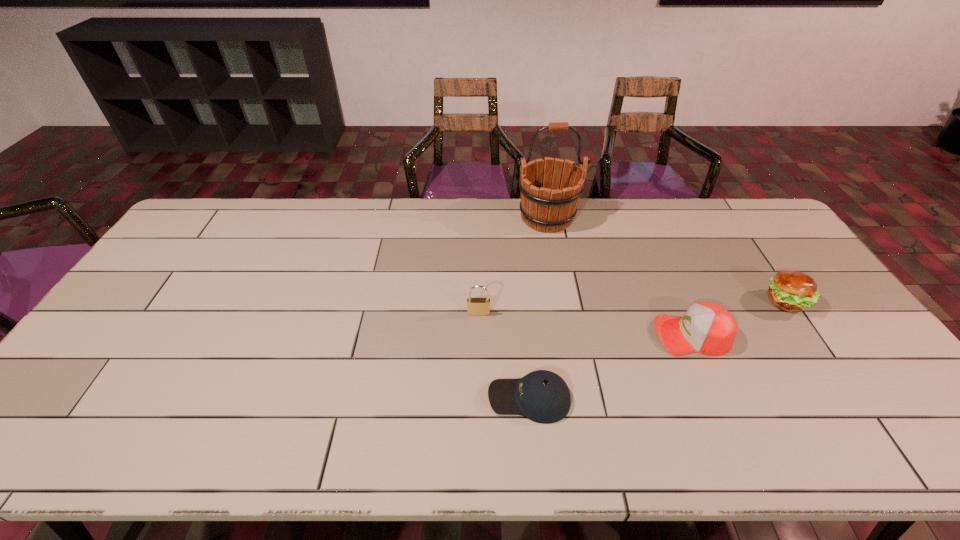
The image size is (960, 540). What are the coordinates of `free space between the right baseball cap and the padlock` in the screenshot? It's located at (586, 324).

Find the location of a particular element. The height and width of the screenshot is (540, 960). vacant area between the left baseball cap and the padlock is located at coordinates (504, 356).

Locate an element on the screen. Image resolution: width=960 pixels, height=540 pixels. empty space that is in between the padlock and the wine bucket is located at coordinates click(x=513, y=265).

Find the location of a particular element. This screenshot has height=540, width=960. empty space between the wine bucket and the shortest object is located at coordinates (538, 308).

Where is `free space between the taller baseball cap and the hamburger`? free space between the taller baseball cap and the hamburger is located at coordinates (739, 318).

I want to click on free space between the tallest object and the padlock, so click(513, 265).

Image resolution: width=960 pixels, height=540 pixels. Identify the location of blank region between the padlock and the tallest object. (513, 265).

Point out which object is positioned as the third nearest to the taller baseball cap. Please provide its 2D coordinates. Your answer should be formatted as a tuple, i.e. [(x, y)], where the tuple contains the x and y coordinates of a point satisfying the conditions above.

[(545, 207)]

Select which object appears as the second closest to the farthest object. Please provide its 2D coordinates. Your answer should be formatted as a tuple, i.e. [(x, y)], where the tuple contains the x and y coordinates of a point satisfying the conditions above.

[(707, 328)]